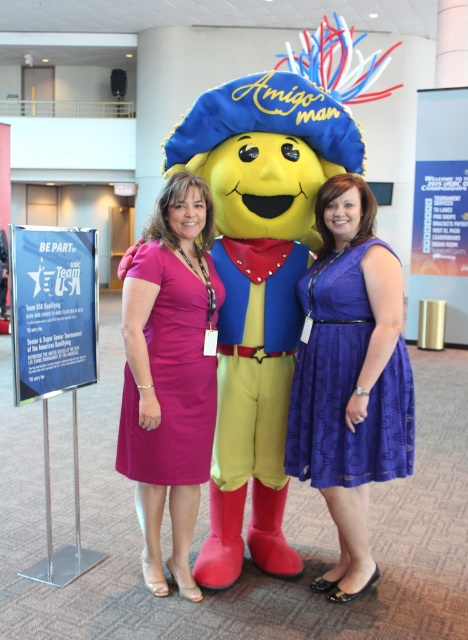
From the picture: Can you confirm if purple lace dress at center is bigger than pink satin dress at center?

Indeed, purple lace dress at center has a larger size compared to pink satin dress at center.

Who is lower down, purple lace dress at center or pink satin dress at center?

pink satin dress at center is below.

Which is behind, point (393, 385) or point (183, 320)?

The point (183, 320) is more distant.

Locate an element on the screen. Image resolution: width=468 pixels, height=640 pixels. purple lace dress at center is located at coordinates (345, 385).